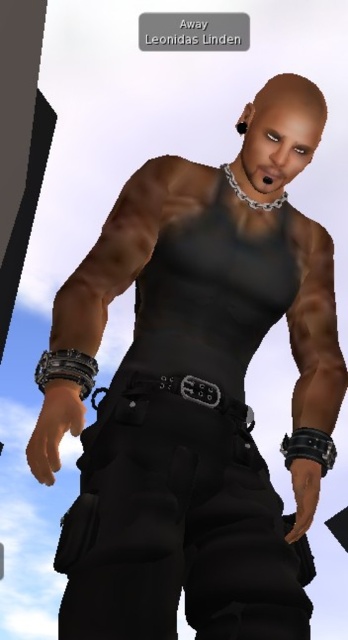
Between matte black tank top at center and black leather belt at center, which one appears on the left side from the viewer's perspective?

Positioned to the left is matte black tank top at center.

Which is above, matte black tank top at center or black leather belt at center?

matte black tank top at center

You are a GUI agent. You are given a task and a screenshot of the screen. Output one action in this format:
    pyautogui.click(x=<x>, y=<y>)
    Task: Click on the matte black tank top at center
    The height and width of the screenshot is (640, 348).
    Given the screenshot: What is the action you would take?
    pyautogui.click(x=190, y=451)

In order to click on matte black tank top at center in this screenshot , I will do `click(190, 451)`.